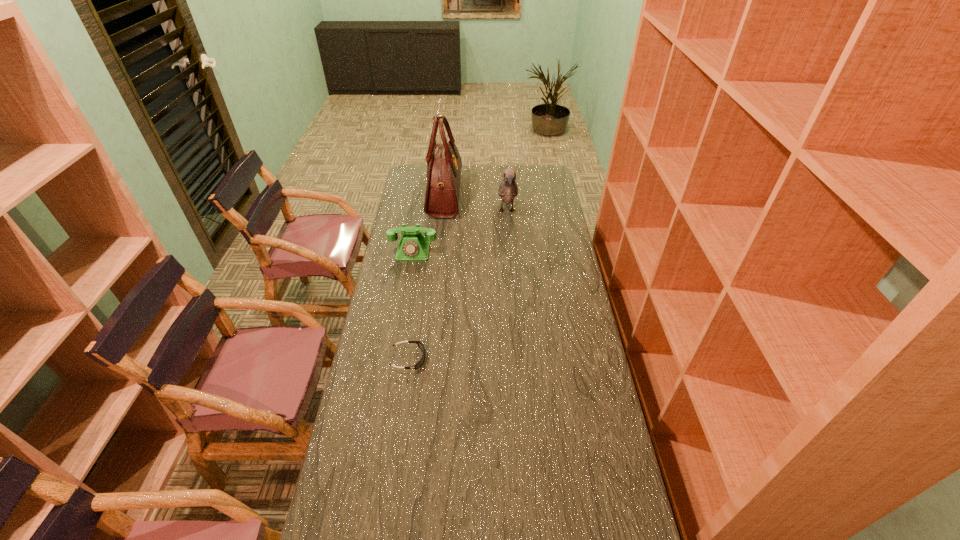
Where is `vacant space situated 0.270m on the front and sides of the shortest object`? Image resolution: width=960 pixels, height=540 pixels. vacant space situated 0.270m on the front and sides of the shortest object is located at coordinates (506, 359).

Find the location of a particular element. This screenshot has height=540, width=960. object present at the far edge is located at coordinates (444, 163).

Image resolution: width=960 pixels, height=540 pixels. I want to click on handbag positioned at the left edge, so click(444, 163).

Locate an element on the screen. This screenshot has width=960, height=540. telephone that is at the left edge is located at coordinates (413, 246).

Where is `goggles at the left edge`? goggles at the left edge is located at coordinates (420, 345).

Where is `object located at the far left corner`? object located at the far left corner is located at coordinates (444, 163).

The image size is (960, 540). I want to click on vacant position at the far edge of the desktop, so click(478, 177).

What are the coordinates of `vacant area at the left edge` in the screenshot? It's located at (421, 199).

Where is `free space at the right edge`? Image resolution: width=960 pixels, height=540 pixels. free space at the right edge is located at coordinates (561, 247).

In order to click on vacant space at the far left corner of the desktop in this screenshot , I will do `click(411, 173)`.